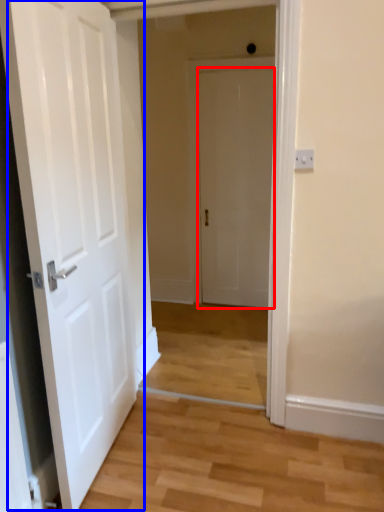
Question: Which object appears farthest to the camera in this image, door (highlighted by a red box) or door (highlighted by a blue box)?

Choices:
 (A) door
 (B) door

Answer: (A)